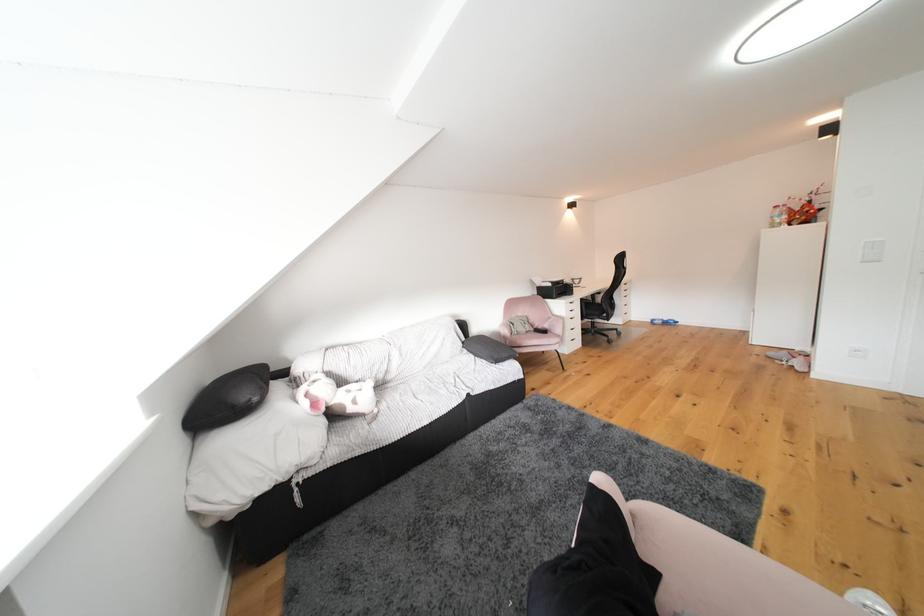
Where is `white light switch`? white light switch is located at coordinates (871, 251).